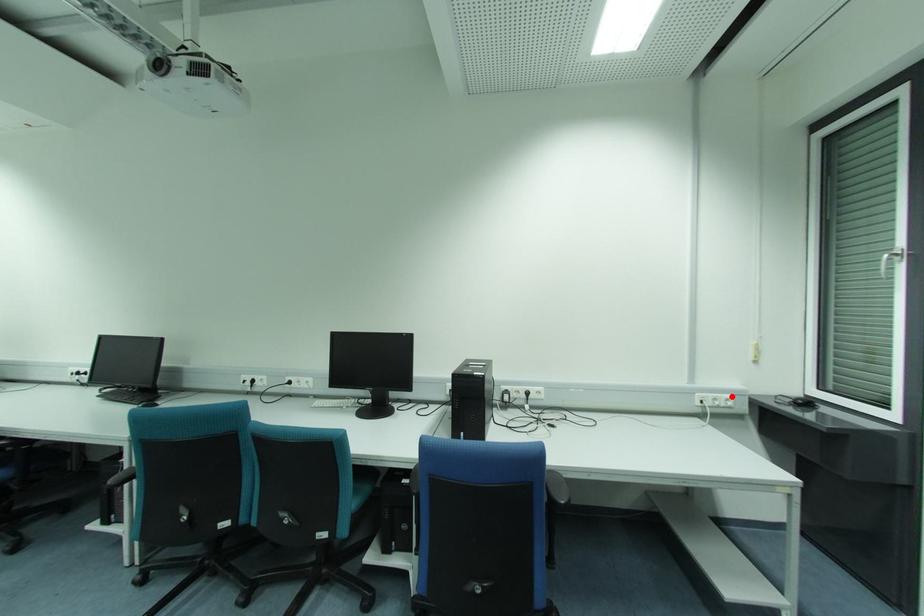
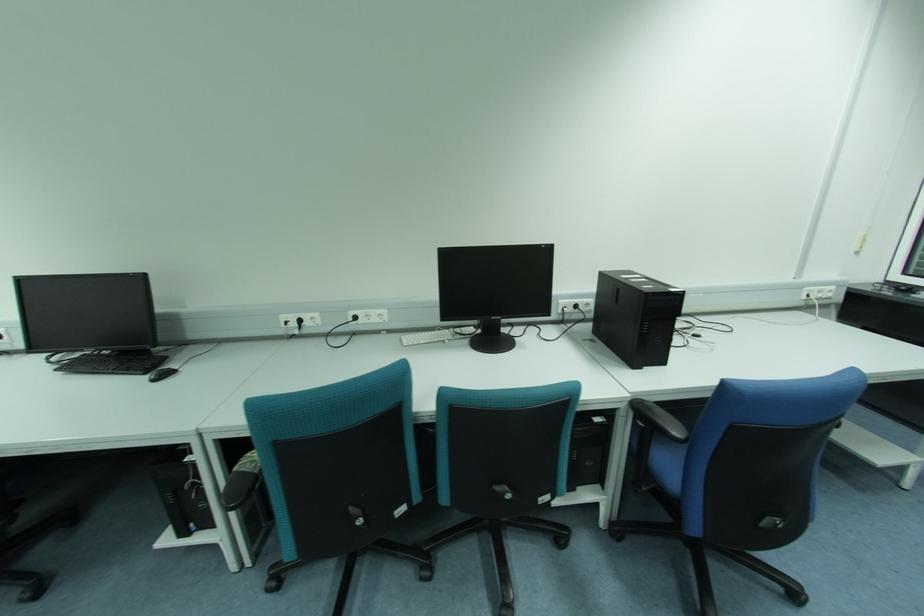
Question: I am providing you with two images of the same scene from different viewpoints. A red point is marked on the first image. Is the red point's position out of view in image 2?

Choices:
 (A) Yes
 (B) No

Answer: (B)